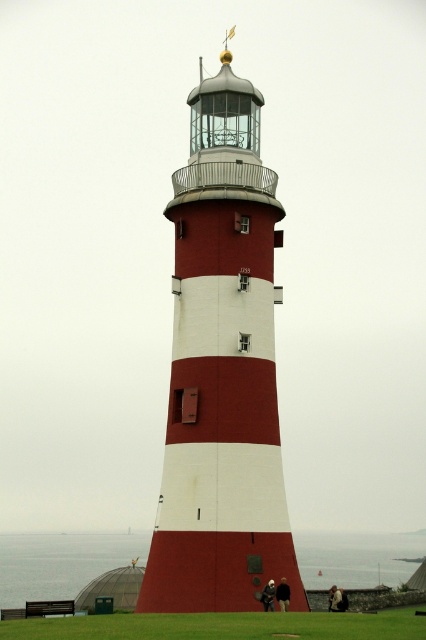
Question: Which object is positioned closest to the green grass at lower center?

Choices:
 (A) transparent water at lower center
 (B) smooth painted lighthouse at center

Answer: (B)

Question: Can you confirm if smooth painted lighthouse at center is positioned to the right of green grass at lower center?

Choices:
 (A) no
 (B) yes

Answer: (A)

Question: Does smooth painted lighthouse at center have a larger size compared to transparent water at lower center?

Choices:
 (A) no
 (B) yes

Answer: (A)

Question: Which point is farther to the camera?

Choices:
 (A) green grass at lower center
 (B) smooth painted lighthouse at center
 (C) transparent water at lower center

Answer: (C)

Question: Does smooth painted lighthouse at center appear under transparent water at lower center?

Choices:
 (A) yes
 (B) no

Answer: (B)

Question: Which of these objects is positioned closest to the transparent water at lower center?

Choices:
 (A) smooth painted lighthouse at center
 (B) green grass at lower center

Answer: (B)